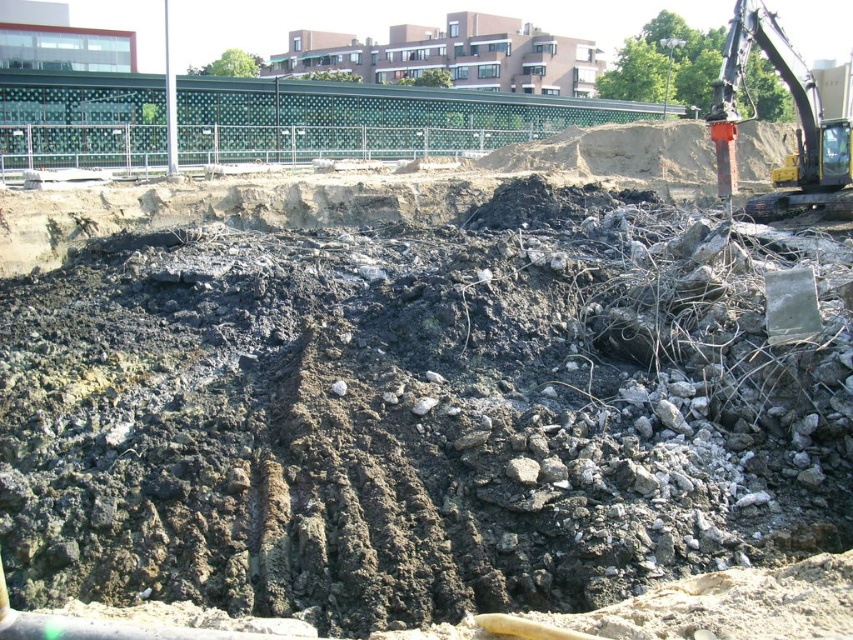
Is yellow metallic excavator at upper right above rusty metal pile at upper right?

Actually, yellow metallic excavator at upper right is below rusty metal pile at upper right.

Between yellow metallic excavator at upper right and rusty metal pile at upper right, which one has less height?

Standing shorter between the two is rusty metal pile at upper right.

Is point (770, 209) farther from camera compared to point (631, 161)?

No.

This screenshot has height=640, width=853. Find the location of `yellow metallic excavator at upper right`. yellow metallic excavator at upper right is located at coordinates (796, 129).

Locate an element on the screen. dull brown soil at center is located at coordinates (413, 416).

In the scene shown: Who is more distant from viewer, (663, 467) or (784, 42)?

Positioned behind is point (784, 42).

You are a GUI agent. You are given a task and a screenshot of the screen. Output one action in this format:
    pyautogui.click(x=<x>, y=<y>)
    Task: Click on the dull brown soil at center
    
    Given the screenshot: What is the action you would take?
    pyautogui.click(x=413, y=416)

Between dull brown soil at center and rusty metal pile at upper right, which one appears on the right side from the viewer's perspective?

rusty metal pile at upper right is more to the right.

Which is behind, point (590, 509) or point (618, 164)?

Positioned behind is point (618, 164).

Where is `dull brown soil at center`? The image size is (853, 640). dull brown soil at center is located at coordinates (413, 416).